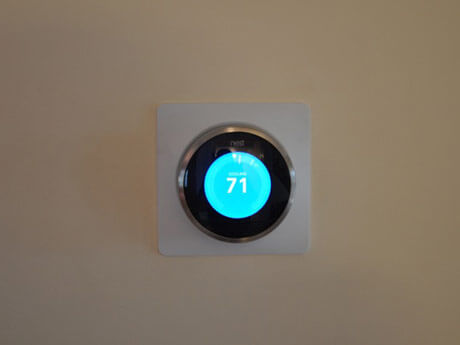
Locate an element on the screen. The width and height of the screenshot is (460, 345). empty space on wall to the top of thermostat is located at coordinates pyautogui.click(x=247, y=48).